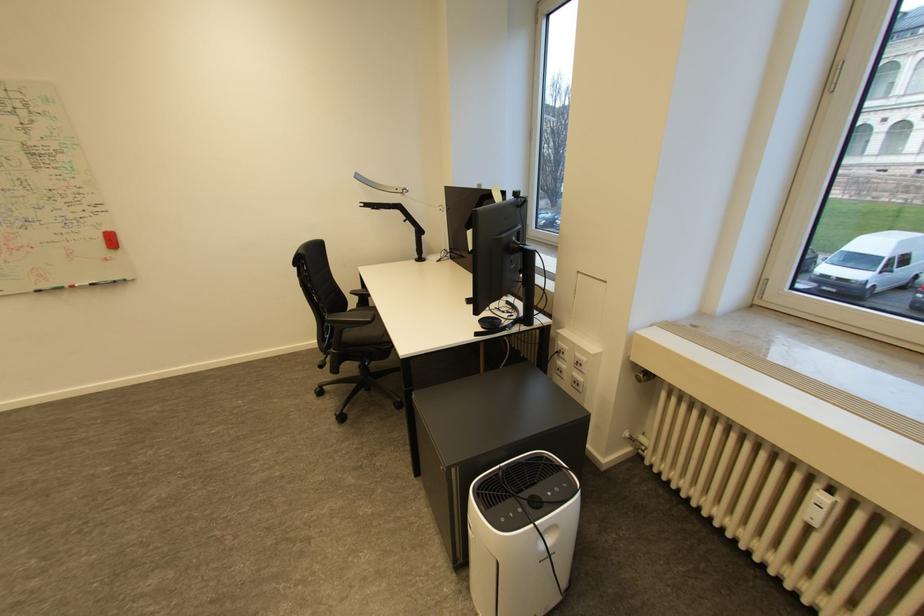
This screenshot has height=616, width=924. I want to click on black computer mouse, so click(490, 322).